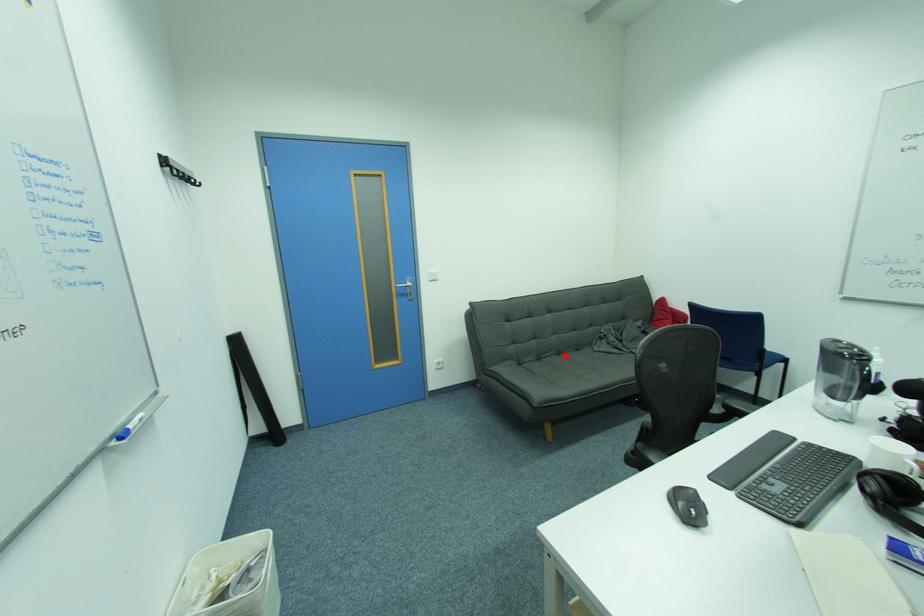
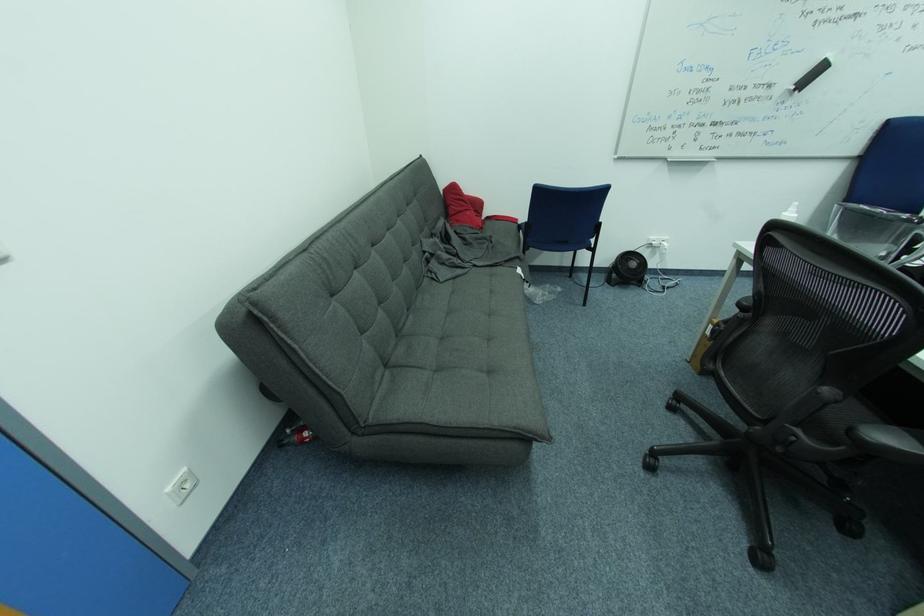
The point at the highlighted location is marked in the first image. Where is the corresponding point in the second image?

(415, 312)